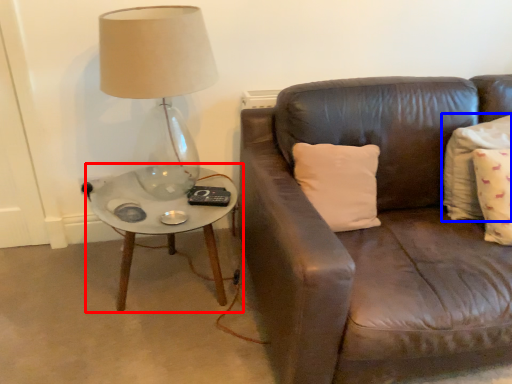
Question: Which of the following is the closest to the observer, coffee table (highlighted by a red box) or pillow (highlighted by a blue box)?

Choices:
 (A) coffee table
 (B) pillow

Answer: (B)